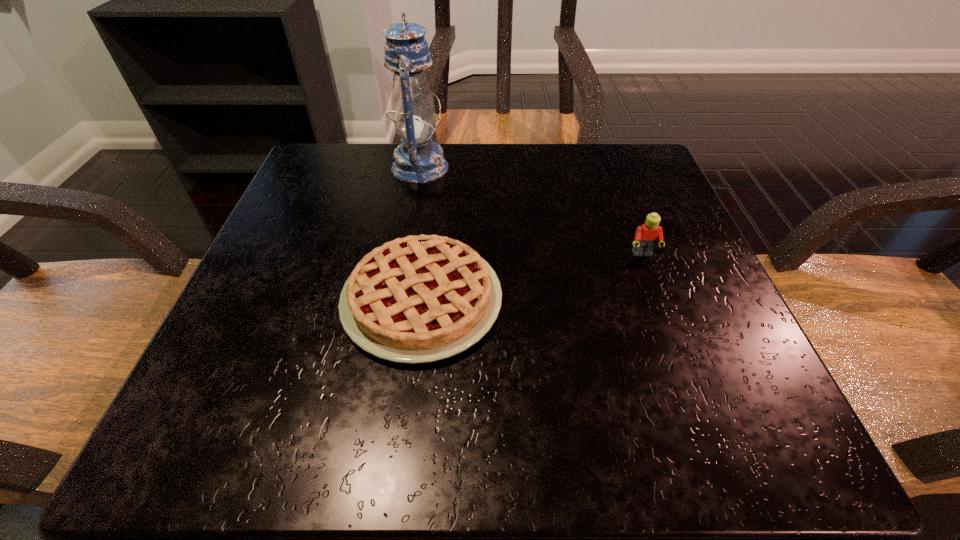
Identify the location of lantern. The width and height of the screenshot is (960, 540). (418, 159).

Locate an element on the screen. the tallest object is located at coordinates (418, 159).

You are a GUI agent. You are given a task and a screenshot of the screen. Output one action in this format:
    pyautogui.click(x=<x>, y=<y>)
    Task: Click on the second shortest object
    
    Given the screenshot: What is the action you would take?
    pyautogui.click(x=646, y=236)

Identify the location of the rightmost object. The height and width of the screenshot is (540, 960). tap(646, 236).

Identify the location of pie. (422, 298).

The height and width of the screenshot is (540, 960). Identify the location of vacant space located on the front-facing side of the lantern. [x=524, y=167].

The width and height of the screenshot is (960, 540). I want to click on vacant space located 0.070m on the face of the Lego, so click(x=657, y=291).

This screenshot has height=540, width=960. I want to click on vacant space situated 0.290m on the right of the pie, so click(692, 300).

Identify the location of object at the far edge. (418, 159).

This screenshot has width=960, height=540. Identify the location of object that is at the left edge. (422, 298).